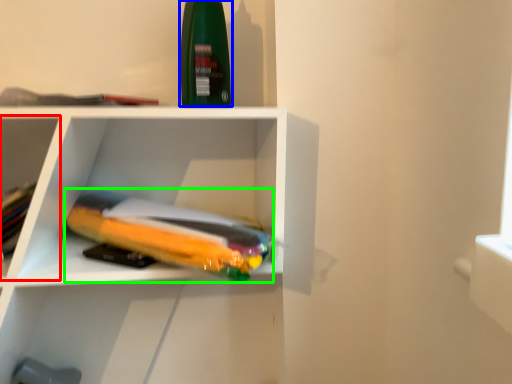
Question: Which object is positioned closest to shelf (highlighted by a red box)? Select from cleaning product (highlighted by a blue box) and book (highlighted by a green box).

Choices:
 (A) cleaning product
 (B) book

Answer: (B)